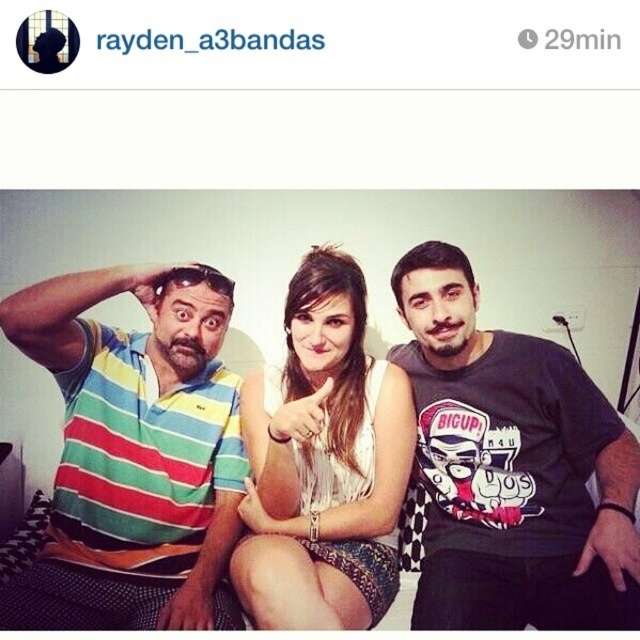
Can you confirm if black matte t-shirt at right is wider than white textured dress at center?

Indeed, black matte t-shirt at right has a greater width compared to white textured dress at center.

What are the coordinates of `black matte t-shirt at right` in the screenshot? It's located at (509, 467).

The height and width of the screenshot is (640, 640). I want to click on black matte t-shirt at right, so click(x=509, y=467).

Between point (141, 429) and point (288, 296), which one is positioned behind?

The point (141, 429) is more distant.

Does striped polo shirt at left have a lesser width compared to white textured dress at center?

No.

The image size is (640, 640). Identify the location of striped polo shirt at left. (134, 452).

Identify the location of striped polo shirt at left. (134, 452).

What do you see at coordinates (134, 452) in the screenshot? The height and width of the screenshot is (640, 640). I see `striped polo shirt at left` at bounding box center [134, 452].

Find the location of a particular element. Image resolution: width=640 pixels, height=640 pixels. striped polo shirt at left is located at coordinates (134, 452).